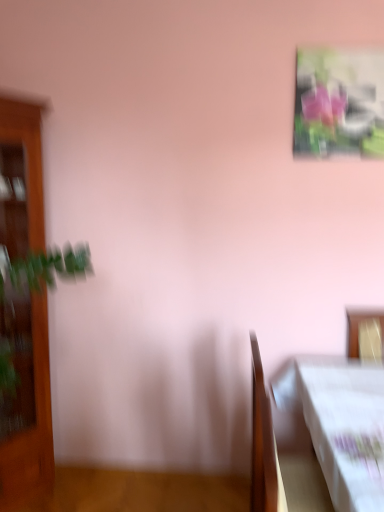
Question: Is point (349, 480) closer or farther from the camera than point (13, 459)?

Choices:
 (A) closer
 (B) farther

Answer: (A)

Question: Based on their positions, is wooden table at lower right located to the left or right of wooden cabinet at left?

Choices:
 (A) right
 (B) left

Answer: (A)

Question: Which object is positioned farthest from the wooden table at lower right?

Choices:
 (A) wooden cabinet at left
 (B) metallic glossy picture frame at upper right

Answer: (A)

Question: Estimate the real-world distances between objects in this image. Which object is farther from the metallic glossy picture frame at upper right?

Choices:
 (A) wooden cabinet at left
 (B) wooden table at lower right

Answer: (A)